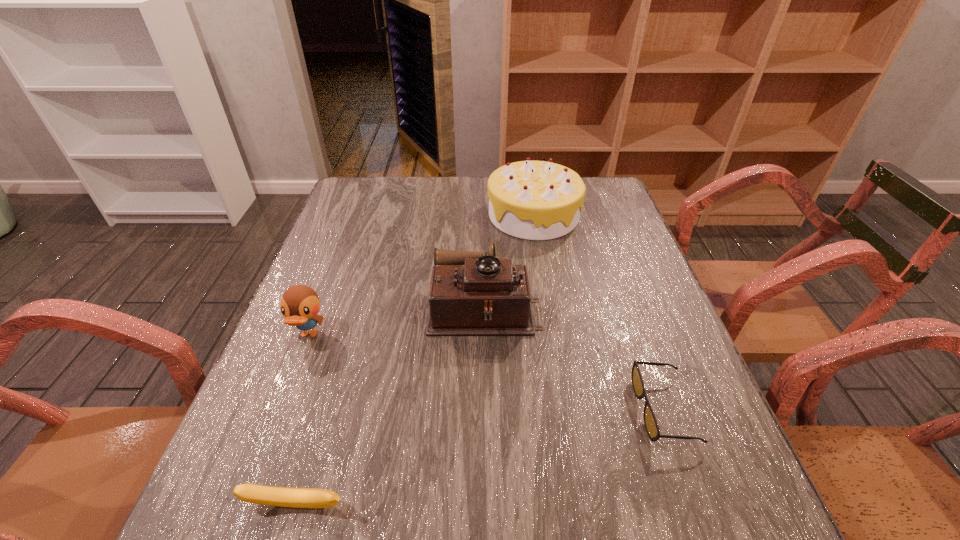
The height and width of the screenshot is (540, 960). Find the location of `object present at the near left corner`. object present at the near left corner is located at coordinates (252, 493).

The image size is (960, 540). What are the coordinates of `object that is at the far right corner` in the screenshot? It's located at (535, 200).

Find the location of a particular element. This screenshot has height=540, width=960. vacant space at the far edge is located at coordinates (407, 193).

In the image, there is a desktop. Identify the location of vacant space at the near edge. The width and height of the screenshot is (960, 540). (560, 522).

Identify the location of vacant space at the left edge of the desktop. This screenshot has width=960, height=540. (377, 227).

Where is `vacant region at the right edge`? This screenshot has height=540, width=960. vacant region at the right edge is located at coordinates (697, 424).

The height and width of the screenshot is (540, 960). Identify the location of free space at the near left corner of the desktop. [236, 530].

Locate an element on the screen. free space that is in between the nearest object and the shortest object is located at coordinates (480, 458).

I want to click on free spot between the third tallest object and the nearest object, so click(303, 420).

I want to click on vacant point located between the phonograph_record and the nearest object, so click(x=391, y=406).